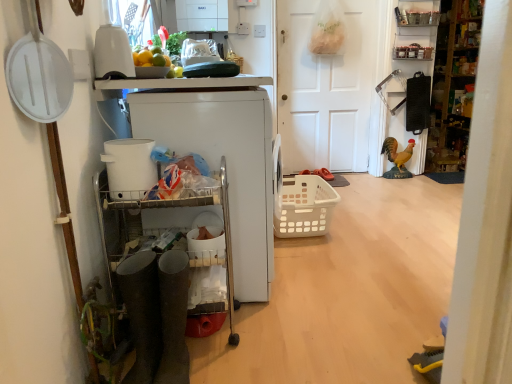
The height and width of the screenshot is (384, 512). I want to click on empty space that is to the right of white plastic basket at center, so click(377, 226).